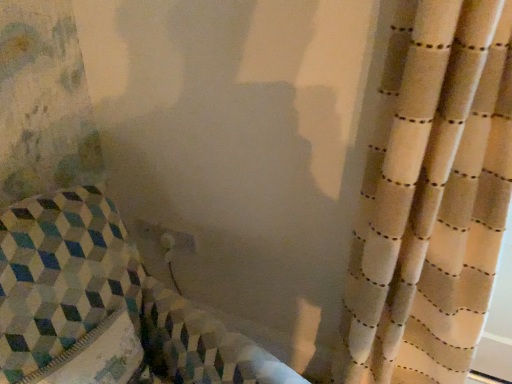
Describe the element at coordinates (105, 307) in the screenshot. This screenshot has height=384, width=512. I see `patterned fabric cushion at left` at that location.

I want to click on patterned fabric cushion at left, so click(105, 307).

Where is `patterned fabric cushion at left`? The image size is (512, 384). patterned fabric cushion at left is located at coordinates (105, 307).